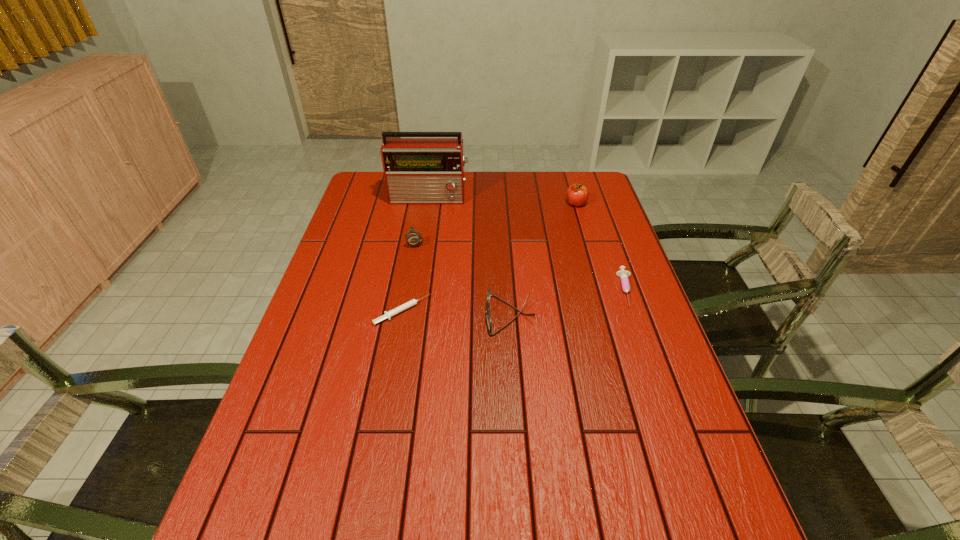
Where is `radio receiver`? radio receiver is located at coordinates (417, 170).

This screenshot has width=960, height=540. What are the coordinates of `apple` in the screenshot? It's located at (577, 194).

What are the coordinates of `compass` in the screenshot? It's located at (413, 238).

Locate an element on the screen. The height and width of the screenshot is (540, 960). spectacles is located at coordinates (488, 318).

Locate an element on the screen. Image resolution: width=960 pixels, height=540 pixels. the third object from right to left is located at coordinates (488, 318).

The width and height of the screenshot is (960, 540). Find the location of `the second shortest object`. the second shortest object is located at coordinates (623, 274).

I want to click on the right syringe, so click(623, 274).

Image resolution: width=960 pixels, height=540 pixels. I want to click on the left syringe, so click(391, 313).

At what (x,y) coordinates should I click in order to perform the action: click on the shortest object. Please return your answer as a coordinate pair (x, y). Image resolution: width=960 pixels, height=540 pixels. Looking at the image, I should click on (391, 313).

The image size is (960, 540). In order to click on free space located on the front-facing side of the radio receiver in this screenshot , I will do `click(422, 241)`.